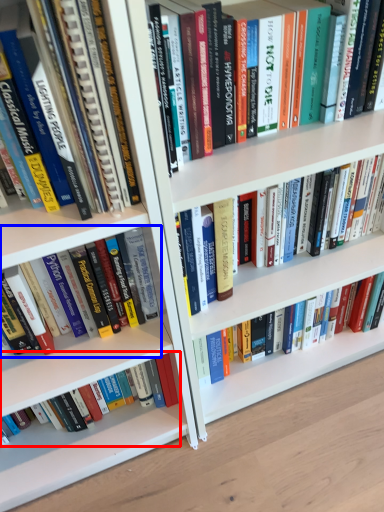
Question: Which object appears closest to the camera in this image, book (highlighted by a red box) or book (highlighted by a blue box)?

Choices:
 (A) book
 (B) book

Answer: (B)